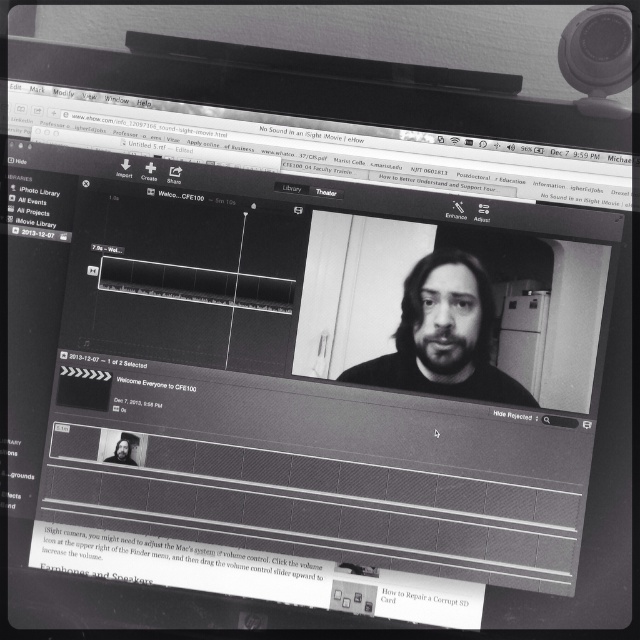
Question: Which object is farther from the camera taking this photo?

Choices:
 (A) dark hair man at center
 (B) black matte face at center

Answer: (A)

Question: Observing the image, what is the correct spatial positioning of black matte face at center in reference to dark hair man at center?

Choices:
 (A) right
 (B) left

Answer: (A)

Question: Is black matte face at center thinner than dark hair man at center?

Choices:
 (A) yes
 (B) no

Answer: (B)

Question: Can you confirm if black matte face at center is positioned to the left of dark hair man at center?

Choices:
 (A) no
 (B) yes

Answer: (A)

Question: Which of the following is the closest to the observer?

Choices:
 (A) (125, 451)
 (B) (440, 294)

Answer: (A)